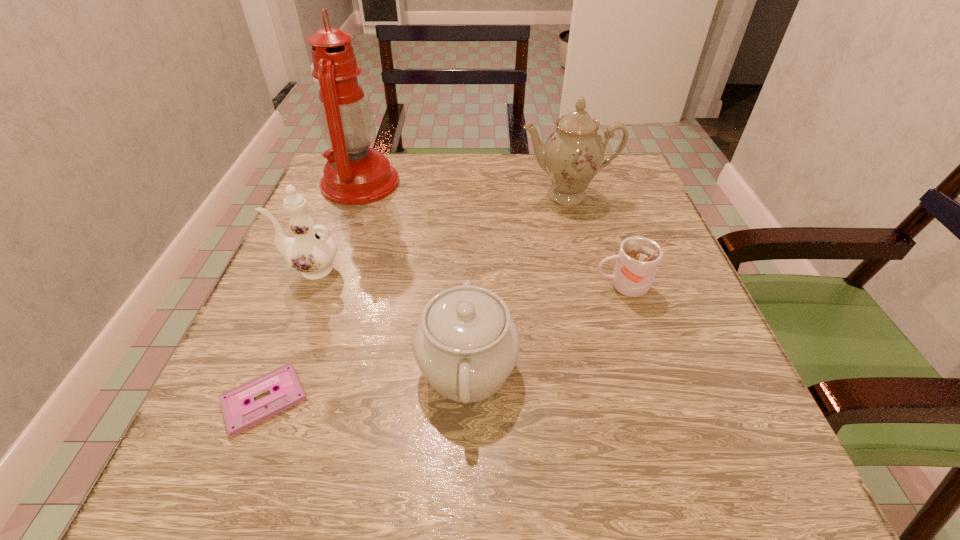
Image resolution: width=960 pixels, height=540 pixels. I want to click on vacant region between the cup and the oil lamp, so click(492, 235).

I want to click on unoccupied position between the second nearest chinaware and the shortest object, so click(287, 334).

This screenshot has width=960, height=540. I want to click on empty location between the second tallest chinaware and the nearest chinaware, so click(389, 319).

Where is `free area in between the fifth tallest object and the second tallest object`? free area in between the fifth tallest object and the second tallest object is located at coordinates (594, 241).

Find the location of `free space between the second nearest chinaware and the tallest chinaware`. free space between the second nearest chinaware and the tallest chinaware is located at coordinates (439, 232).

Locate which object ranks third in proximity to the tallest object. Please provide its 2D coordinates. Your answer should be formatted as a tuple, i.e. [(x, y)], where the tuple contains the x and y coordinates of a point satisfying the conditions above.

[(466, 345)]

The width and height of the screenshot is (960, 540). I want to click on object that is the fifth closest one to the videotape, so click(573, 154).

Identify which chinaware is the second nearest to the cup. Please provide its 2D coordinates. Your answer should be formatted as a tuple, i.e. [(x, y)], where the tuple contains the x and y coordinates of a point satisfying the conditions above.

[(573, 154)]

Where is `the second closest chinaware to the fourth shortest object`? This screenshot has width=960, height=540. the second closest chinaware to the fourth shortest object is located at coordinates (573, 154).